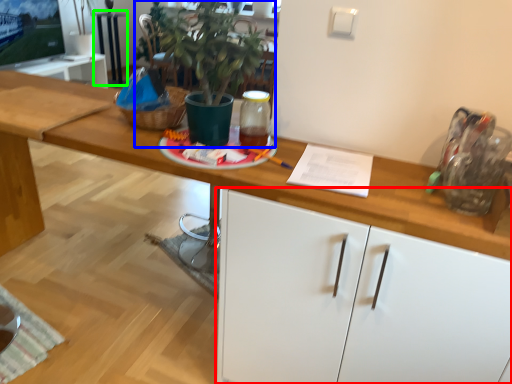
Question: Which object is the farthest from cabinetry (highlighted by a red box)? Choose among these: houseplant (highlighted by a blue box) or table (highlighted by a green box).

Choices:
 (A) houseplant
 (B) table

Answer: (B)